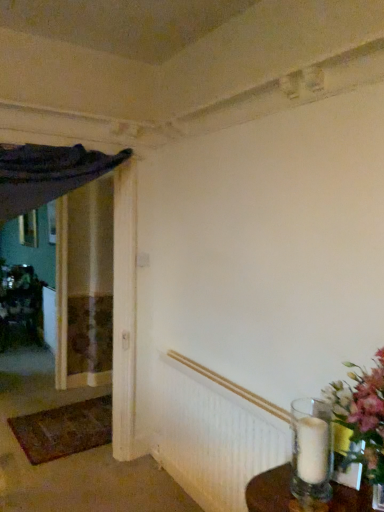
Question: From the image's perspective, is clear glass vase at lower right above brown woven mat at lower left?

Choices:
 (A) yes
 (B) no

Answer: (A)

Question: Is there a large distance between clear glass vase at lower right and brown woven mat at lower left?

Choices:
 (A) yes
 (B) no

Answer: (A)

Question: Does clear glass vase at lower right contain brown woven mat at lower left?

Choices:
 (A) no
 (B) yes

Answer: (A)

Question: Is clear glass vase at lower right thinner than brown woven mat at lower left?

Choices:
 (A) no
 (B) yes

Answer: (B)

Question: Is clear glass vase at lower right facing towards brown woven mat at lower left?

Choices:
 (A) yes
 (B) no

Answer: (B)

Question: From a real-world perspective, is metallic silver vase at left physically located above or below white textured radiator at lower right?

Choices:
 (A) below
 (B) above

Answer: (A)

Question: From the image's perspective, is metallic silver vase at left located above or below white textured radiator at lower right?

Choices:
 (A) above
 (B) below

Answer: (A)

Question: Is point (21, 266) positioned closer to the camera than point (188, 371)?

Choices:
 (A) farther
 (B) closer

Answer: (A)

Question: In terms of width, does metallic silver vase at left look wider or thinner when compared to white textured radiator at lower right?

Choices:
 (A) thin
 (B) wide

Answer: (B)

Question: Looking at the image, does white textured radiator at lower right seem bigger or smaller compared to metallic silver vase at left?

Choices:
 (A) small
 (B) big

Answer: (A)

Question: Is point (208, 445) positioned closer to the camera than point (11, 321)?

Choices:
 (A) closer
 (B) farther

Answer: (A)

Question: In terms of width, does white textured radiator at lower right look wider or thinner when compared to metallic silver vase at left?

Choices:
 (A) wide
 (B) thin

Answer: (B)

Question: From the image's perspective, relative to metallic silver vase at left, is white textured radiator at lower right above or below?

Choices:
 (A) above
 (B) below

Answer: (B)

Question: Is clear glass vase at lower right in front of or behind wooden picture frame at left in the image?

Choices:
 (A) behind
 (B) front

Answer: (B)

Question: Visually, is clear glass vase at lower right positioned to the left or to the right of wooden picture frame at left?

Choices:
 (A) left
 (B) right

Answer: (B)